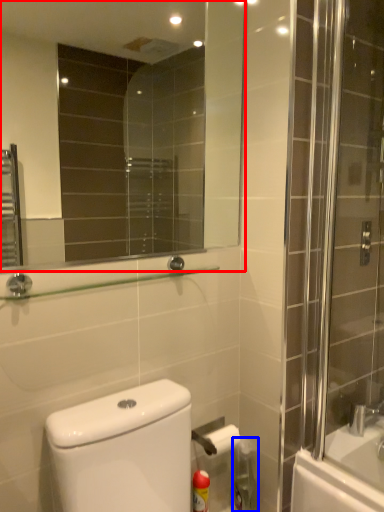
Question: Which of the following is the farthest to the observer, mirror (highlighted by a red box) or cleaning product (highlighted by a blue box)?

Choices:
 (A) mirror
 (B) cleaning product

Answer: (B)